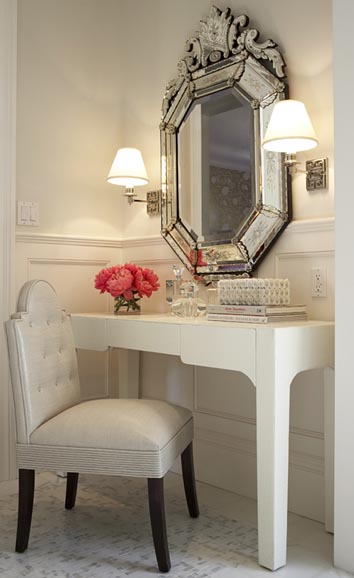
Where is `books`? books is located at coordinates (237, 310).